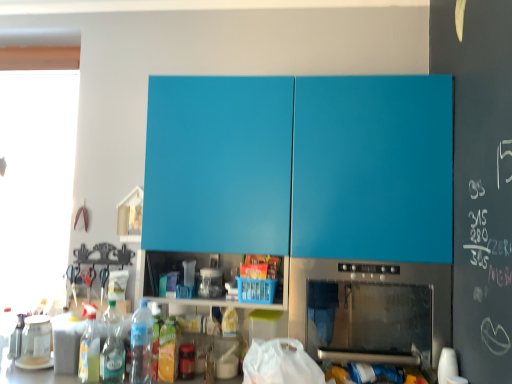
Question: From a real-world perspective, is stainless steel oven at lower center over matte blue cabinet at upper center?

Choices:
 (A) yes
 (B) no

Answer: (B)

Question: Is matte blue cabinet at upper center located within stainless steel oven at lower center?

Choices:
 (A) no
 (B) yes

Answer: (A)

Question: Is the depth of stainless steel oven at lower center less than that of matte blue cabinet at upper center?

Choices:
 (A) no
 (B) yes

Answer: (B)

Question: From the image's perspective, is stainless steel oven at lower center located beneath matte blue cabinet at upper center?

Choices:
 (A) no
 (B) yes

Answer: (B)

Question: Does stainless steel oven at lower center have a greater height compared to matte blue cabinet at upper center?

Choices:
 (A) no
 (B) yes

Answer: (A)

Question: Is clear plastic bottle at lower left, positioned as the second bottle in left-to-right order, in front of or behind translucent plastic bottle at lower left, arranged as the first bottle when viewed from the right, in the image?

Choices:
 (A) behind
 (B) front

Answer: (A)

Question: Considering the positions of clear plastic bottle at lower left, marked as the 2th bottle in a right-to-left arrangement, and translucent plastic bottle at lower left, arranged as the first bottle when viewed from the right, in the image, is clear plastic bottle at lower left, marked as the 2th bottle in a right-to-left arrangement, bigger or smaller than translucent plastic bottle at lower left, arranged as the first bottle when viewed from the right,?

Choices:
 (A) big
 (B) small

Answer: (B)

Question: Is clear plastic bottle at lower left, marked as the 2th bottle in a right-to-left arrangement, taller or shorter than translucent plastic bottle at lower left, arranged as the first bottle when viewed from the right?

Choices:
 (A) tall
 (B) short

Answer: (B)

Question: Considering the positions of clear plastic bottle at lower left, marked as the 2th bottle in a right-to-left arrangement, and translucent plastic bottle at lower left, arranged as the first bottle when viewed from the right, in the image, is clear plastic bottle at lower left, marked as the 2th bottle in a right-to-left arrangement, wider or thinner than translucent plastic bottle at lower left, arranged as the first bottle when viewed from the right,?

Choices:
 (A) thin
 (B) wide

Answer: (A)

Question: Considering the positions of point pos(35,357) and point pos(202,269), is point pos(35,357) closer or farther from the camera than point pos(202,269)?

Choices:
 (A) closer
 (B) farther

Answer: (B)

Question: Relative to transparent plastic jar at center, the 2th appliance when ordered from left to right, is transparent glass jar at lower left, arranged as the first appliance when viewed from the back, in front or behind?

Choices:
 (A) front
 (B) behind

Answer: (B)

Question: In terms of size, does transparent glass jar at lower left, the second appliance when ordered from right to left, appear bigger or smaller than transparent plastic jar at center, the 2th appliance in the back-to-front sequence?

Choices:
 (A) big
 (B) small

Answer: (A)

Question: From a real-world perspective, is transparent glass jar at lower left, the second appliance when ordered from right to left, positioned above or below transparent plastic jar at center, the 2th appliance in the back-to-front sequence?

Choices:
 (A) below
 (B) above

Answer: (A)

Question: In terms of width, does transparent glass jar at lower left, the 2th appliance viewed from the top, look wider or thinner when compared to matte blue cabinet at upper center?

Choices:
 (A) thin
 (B) wide

Answer: (A)

Question: Does point (36, 347) appear closer or farther from the camera than point (415, 249)?

Choices:
 (A) farther
 (B) closer

Answer: (A)